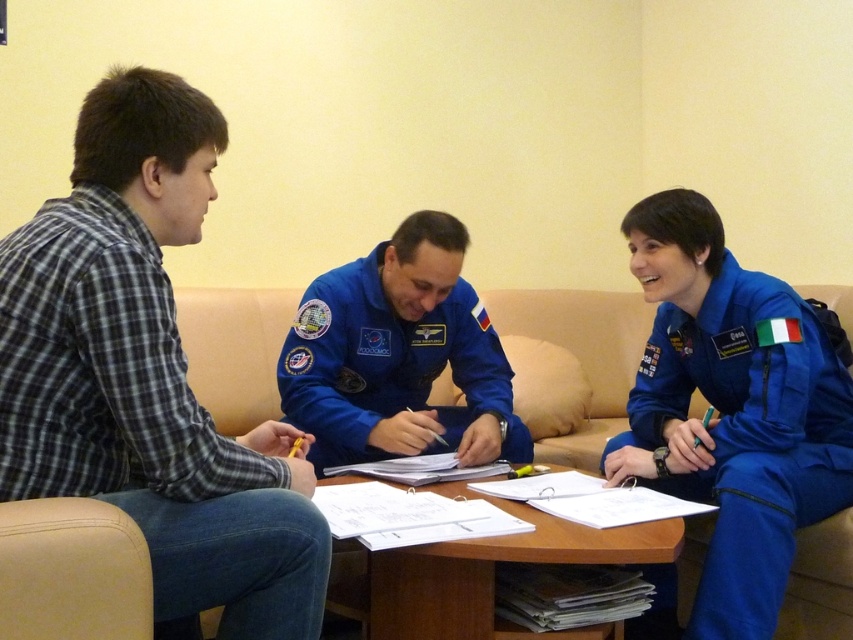
Can you confirm if plaid shirt at left is wider than blue fabric astronaut at center?

No, plaid shirt at left is not wider than blue fabric astronaut at center.

Between plaid shirt at left and blue fabric astronaut at center, which one is positioned lower?

blue fabric astronaut at center

Is point (79, 225) farther from camera compared to point (474, 374)?

That is False.

Identify the location of plaid shirt at left. The image size is (853, 640). [148, 376].

Between plaid shirt at left and wooden table at center, which one is positioned higher?

plaid shirt at left is above.

Measure the distance between plaid shirt at left and wooden table at center.

plaid shirt at left is 19.57 inches from wooden table at center.

What are the coordinates of `plaid shirt at left` in the screenshot? It's located at (148, 376).

In order to click on plaid shirt at left in this screenshot , I will do `click(148, 376)`.

Which is behind, point (433, 321) or point (653, 536)?

Point (433, 321)

Between blue fabric astronaut at center and wooden table at center, which one has less height?

wooden table at center

Who is more forward, [367,374] or [412,630]?

Point [412,630] is in front.

This screenshot has width=853, height=640. In order to click on blue fabric astronaut at center in this screenshot , I will do `click(398, 355)`.